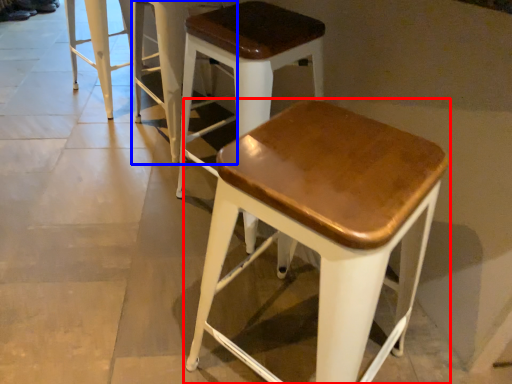
Question: Which of the following is the closest to the observer, stool (highlighted by a red box) or stool (highlighted by a blue box)?

Choices:
 (A) stool
 (B) stool

Answer: (A)